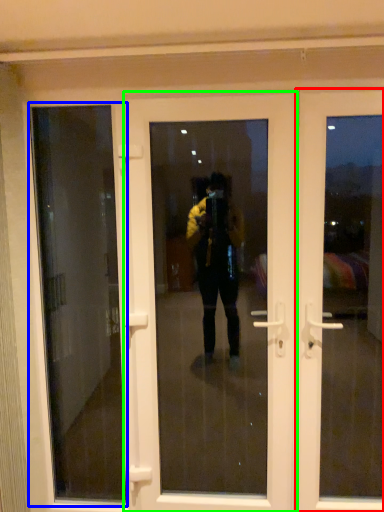
Question: Based on their relative distances, which object is farther from door (highlighted by a red box)? Choose from window screen (highlighted by a blue box) and door (highlighted by a green box).

Choices:
 (A) window screen
 (B) door

Answer: (A)